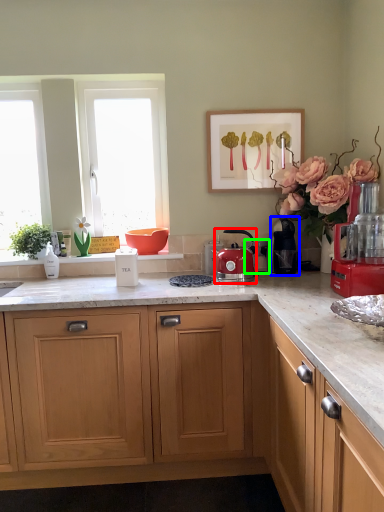
Question: Which is nearer to the kitchen appliance (highlighted by a red box)? coffee machine (highlighted by a blue box) or coffee machine (highlighted by a green box).

Choices:
 (A) coffee machine
 (B) coffee machine

Answer: (A)